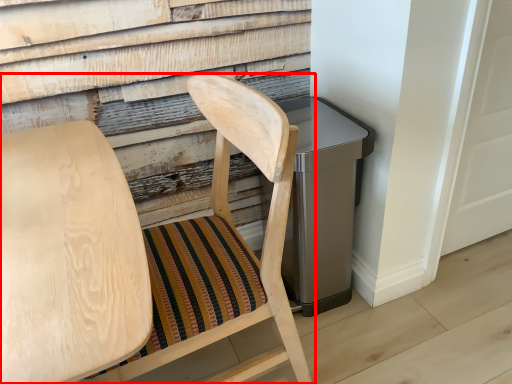
Question: Where is chair (annotated by the red box) located in relation to chair in the image?

Choices:
 (A) left
 (B) right

Answer: (B)